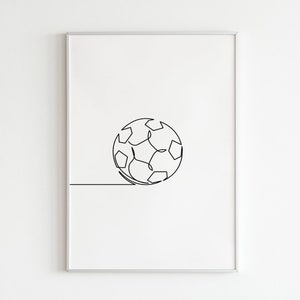
Locate an element on the screen. corner is located at coordinates (65, 270), (236, 271), (236, 32), (66, 32).